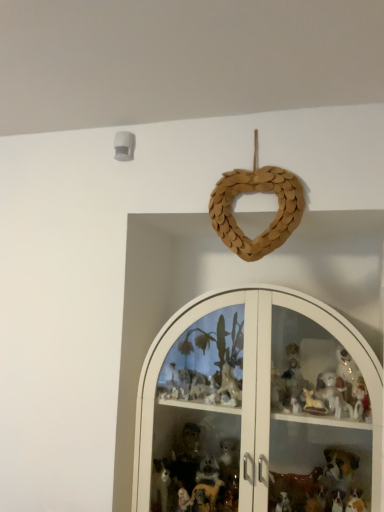
The width and height of the screenshot is (384, 512). Describe the element at coordinates (259, 192) in the screenshot. I see `braided wood heart at upper center` at that location.

Find the location of a particular element. braided wood heart at upper center is located at coordinates (259, 192).

What do you see at coordinates (258, 409) in the screenshot? I see `white glass cabinet at center` at bounding box center [258, 409].

Find the location of a particular element. The image size is (384, 512). white glass cabinet at center is located at coordinates (258, 409).

What is the approximate height of white glass cabinet at center?

It is 87.09 centimeters.

I want to click on braided wood heart at upper center, so click(259, 192).

Can you confirm if white glass cabinet at center is positioned to the right of braided wood heart at upper center?

Yes, white glass cabinet at center is to the right of braided wood heart at upper center.

Is white glass cabinet at center in front of or behind braided wood heart at upper center in the image?

Visually, white glass cabinet at center is located in front of braided wood heart at upper center.

Does point (208, 418) appear closer or farther from the camera than point (234, 231)?

Point (208, 418).

From the picture: From the image's perspective, which one is positioned higher, white glass cabinet at center or braided wood heart at upper center?

From the image's view, braided wood heart at upper center is above.

From a real-world perspective, is white glass cabinet at center physically below braided wood heart at upper center?

Yes, from a real-world perspective, white glass cabinet at center is under braided wood heart at upper center.

Between white glass cabinet at center and braided wood heart at upper center, which one has smaller width?

Thinner between the two is braided wood heart at upper center.

In terms of height, does white glass cabinet at center look taller or shorter compared to braided wood heart at upper center?

Clearly, white glass cabinet at center is taller compared to braided wood heart at upper center.

Considering the relative sizes of white glass cabinet at center and braided wood heart at upper center in the image provided, is white glass cabinet at center smaller than braided wood heart at upper center?

Actually, white glass cabinet at center might be larger than braided wood heart at upper center.

Could braided wood heart at upper center be considered to be inside white glass cabinet at center?

No.

Are white glass cabinet at center and braided wood heart at upper center beside each other?

No, white glass cabinet at center is not touching braided wood heart at upper center.

Is white glass cabinet at center facing towards braided wood heart at upper center?

No, white glass cabinet at center is not aimed at braided wood heart at upper center.

In the image, there is a braided wood heart at upper center. Where is `shelf below it (from the image's perspective)`? This screenshot has width=384, height=512. shelf below it (from the image's perspective) is located at coordinates (258, 409).

Would you say braided wood heart at upper center is to the left or to the right of white glass cabinet at center in the picture?

Based on their positions, braided wood heart at upper center is located to the left of white glass cabinet at center.

Is the position of braided wood heart at upper center less distant than that of white glass cabinet at center?

No, the depth of braided wood heart at upper center is greater than that of white glass cabinet at center.

Does point (303, 203) lie behind point (234, 373)?

No, (303, 203) is closer to viewer.

From the image's perspective, which is above, braided wood heart at upper center or white glass cabinet at center?

From the image's view, braided wood heart at upper center is above.

From a real-world perspective, is braided wood heart at upper center located higher than white glass cabinet at center?

Yes, from a real-world perspective, braided wood heart at upper center is above white glass cabinet at center.

Between braided wood heart at upper center and white glass cabinet at center, which one has larger width?

white glass cabinet at center.

Based on the photo, from their relative heights in the image, would you say braided wood heart at upper center is taller or shorter than white glass cabinet at center?

braided wood heart at upper center is shorter than white glass cabinet at center.

Based on their sizes in the image, would you say braided wood heart at upper center is bigger or smaller than white glass cabinet at center?

braided wood heart at upper center is smaller than white glass cabinet at center.

Would you say white glass cabinet at center is part of braided wood heart at upper center's contents?

No, white glass cabinet at center is not inside braided wood heart at upper center.

Based on the photo, would you say braided wood heart at upper center is a long distance from white glass cabinet at center?

No, braided wood heart at upper center is not far away from white glass cabinet at center.

Is braided wood heart at upper center facing towards white glass cabinet at center?

No, braided wood heart at upper center is not facing towards white glass cabinet at center.

Locate an element on the screen. Image resolution: width=384 pixels, height=512 pixels. shelf in front of the braided wood heart at upper center is located at coordinates (258, 409).

This screenshot has height=512, width=384. I want to click on shelf on the right of braided wood heart at upper center, so click(258, 409).

Image resolution: width=384 pixels, height=512 pixels. Identify the location of shelf below the braided wood heart at upper center (from a real-world perspective). (258, 409).